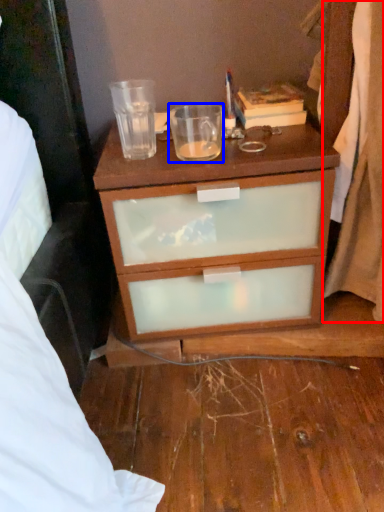
Question: Which point is closer to the camera, curtain (highlighted by a red box) or coffee cup (highlighted by a blue box)?

Choices:
 (A) curtain
 (B) coffee cup

Answer: (A)